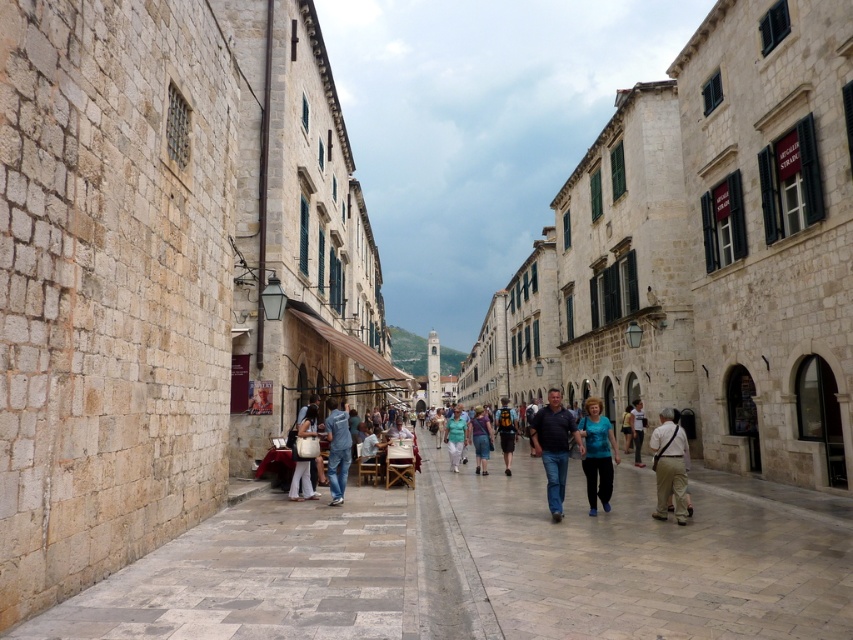
Measure the distance between point (592, 480) and camera.

Point (592, 480) and camera are 149.90 feet apart from each other.

Is point (607, 481) positioned behind point (459, 445)?

No.

You are a GUI agent. You are given a task and a screenshot of the screen. Output one action in this format:
    pyautogui.click(x=<x>, y=<y>)
    Task: Click on the blue fabric shirt at center
    The image size is (853, 640).
    Given the screenshot: What is the action you would take?
    pyautogui.click(x=596, y=454)

This screenshot has width=853, height=640. Identify the location of blue fabric shirt at center. (596, 454).

Which is more to the right, blue denim jeans at center or matte black backpack at center?

matte black backpack at center

Does blue denim jeans at center appear on the right side of matte black backpack at center?

In fact, blue denim jeans at center is to the left of matte black backpack at center.

Describe the element at coordinates (480, 438) in the screenshot. The height and width of the screenshot is (640, 853). I see `blue denim jeans at center` at that location.

Locate an element on the screen. blue denim jeans at center is located at coordinates (480, 438).

Between smooth stone pavement at center and light brown leather jacket at center, which one is positioned higher?

Positioned higher is light brown leather jacket at center.

Does smooth stone pavement at center appear over light brown leather jacket at center?

No, smooth stone pavement at center is not above light brown leather jacket at center.

Which is behind, point (433, 579) or point (633, 410)?

Positioned behind is point (633, 410).

Find the location of a particular element. smooth stone pavement at center is located at coordinates (628, 557).